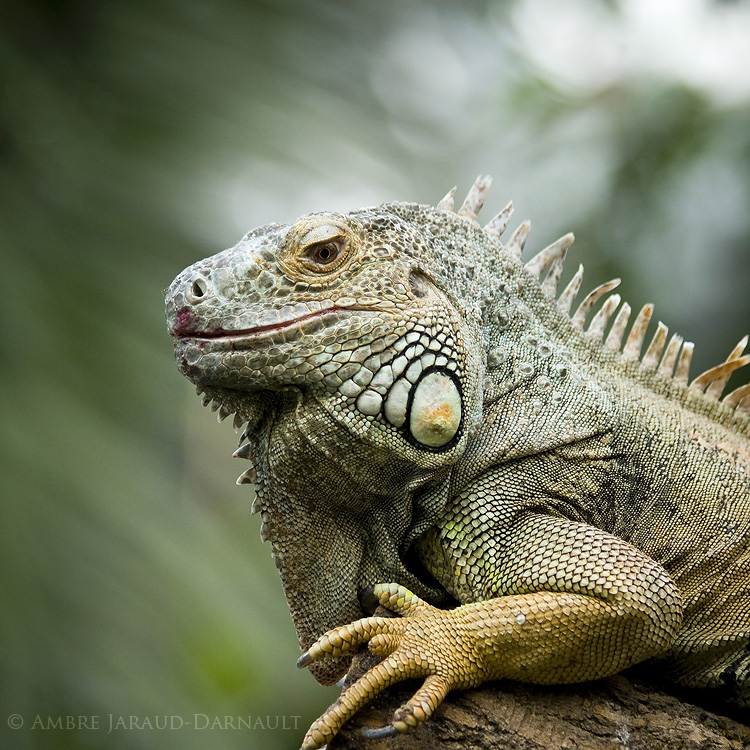
Where is `scales`? scales is located at coordinates (556, 556).